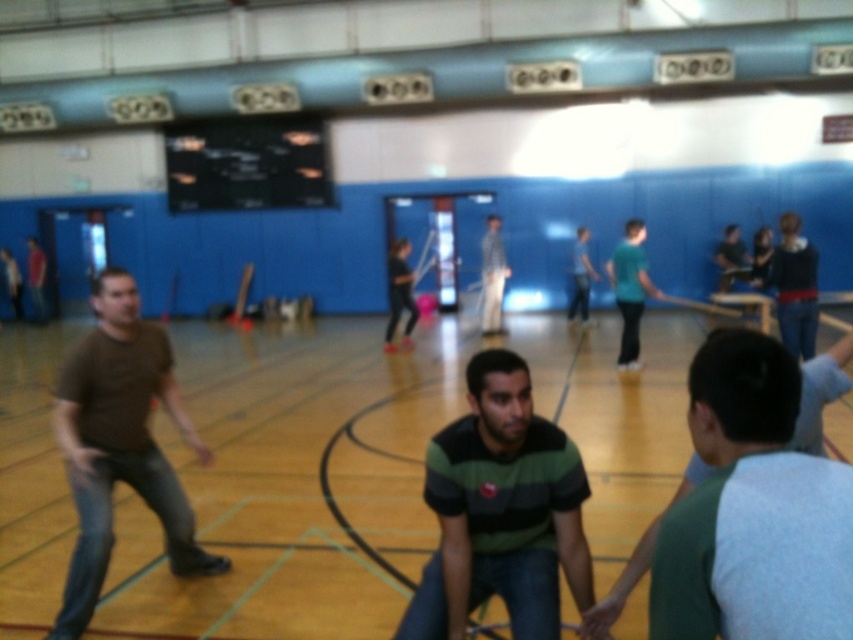
Question: Is green striped shirt at center bigger than white fabric at center?

Choices:
 (A) no
 (B) yes

Answer: (A)

Question: Based on their relative distances, which object is nearer to the green striped shirt at center?

Choices:
 (A) brown matte shirt at left
 (B) gray-green striped shirt at center
 (C) white fabric at center

Answer: (B)

Question: Which object is positioned farthest from the gray-green striped shirt at center?

Choices:
 (A) green striped shirt at center
 (B) brown matte shirt at left

Answer: (B)

Question: Is gray-green striped shirt at center behind white fabric at center?

Choices:
 (A) yes
 (B) no

Answer: (B)

Question: Is green striped shirt at center in front of brown matte shirt at left?

Choices:
 (A) yes
 (B) no

Answer: (A)

Question: Which point appears closest to the camera in this image?

Choices:
 (A) (68, 586)
 (B) (488, 253)

Answer: (A)